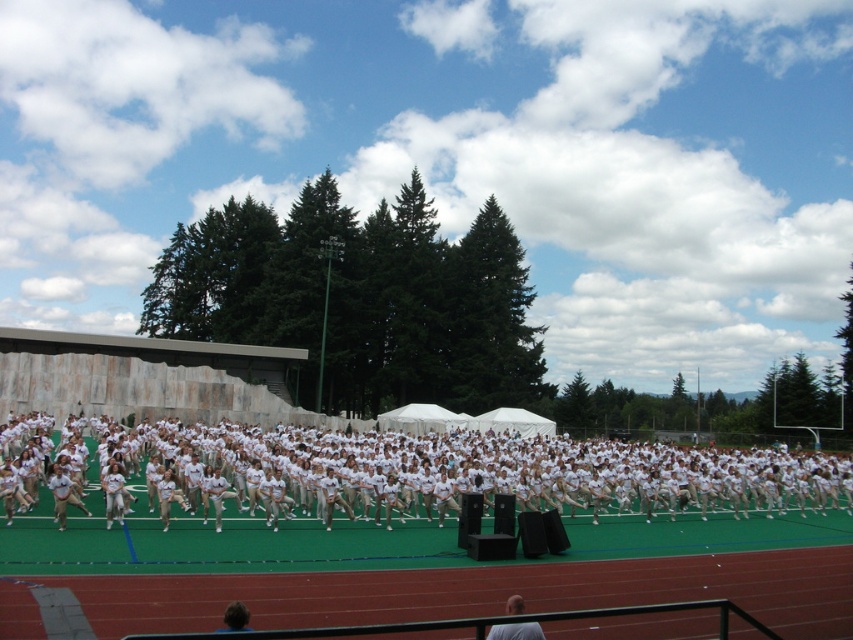
You are a photographer positioned at the back of the sports field. You need to capture a clear photo of the dark brown hair at lower center without the light brown uniform at center blocking the view. Is this possible based on their positions?

The dark brown hair at lower center is behind the light brown uniform at center, so it will be blocked by the uniform. To capture a clear photo, you need to adjust your position to get a better angle where the dark brown hair at lower center is not obstructed by the light brown uniform at center.

You are a photographer standing at the back of the field. You need to capture a clear photo of the light brown uniform at center and the dark brown hair at lower center. Which object will appear taller in the photo?

The dark brown hair at lower center will appear taller in the photo because the light brown uniform at center is shorter than dark brown hair at lower center.